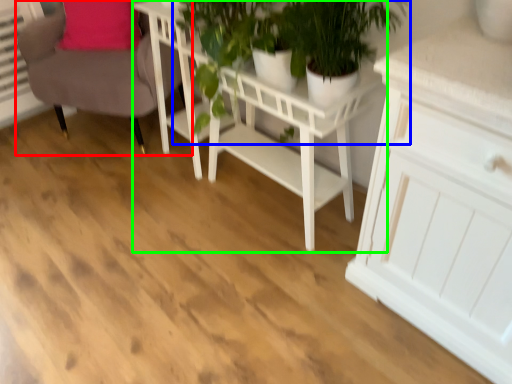
Question: Based on their relative distances, which object is farther from chair (highlighted by a red box)? Choose from houseplant (highlighted by a blue box) and table (highlighted by a green box).

Choices:
 (A) houseplant
 (B) table

Answer: (A)